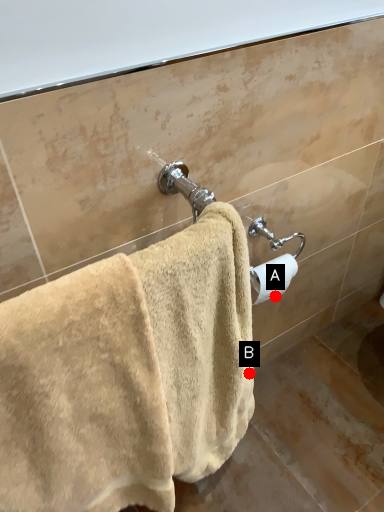
Question: Two points are circled on the image, labeled by A and B beside each circle. Which point is closer to the camera taking this photo?

Choices:
 (A) A is closer
 (B) B is closer

Answer: (B)